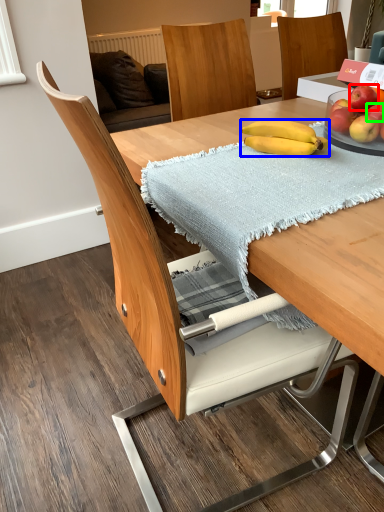
Question: Considering the real-world distances, which object is closest to apple (highlighted by a red box)? banana (highlighted by a blue box) or apple (highlighted by a green box).

Choices:
 (A) banana
 (B) apple

Answer: (B)